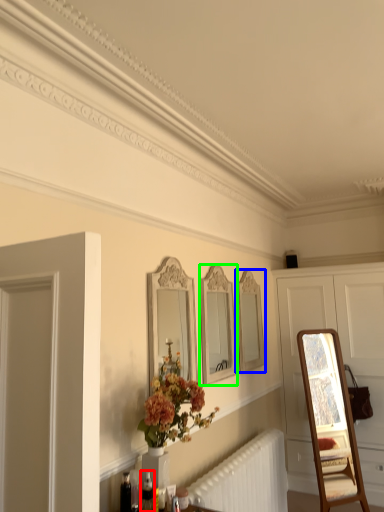
Question: Estimate the real-world distances between objects in this image. Which object is closer to toiletry (highlighted by a red box), mirror (highlighted by a blue box) or mirror (highlighted by a green box)?

Choices:
 (A) mirror
 (B) mirror

Answer: (B)